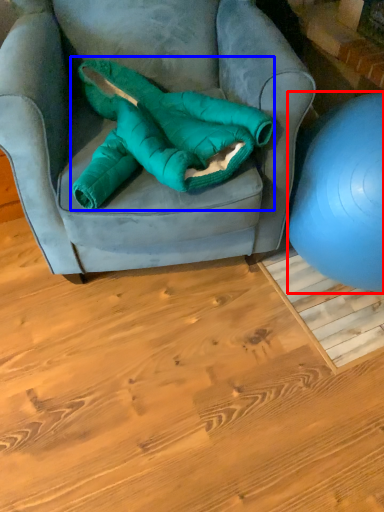
Question: Which point is closer to the camera, ball (highlighted by a red box) or bean bag chair (highlighted by a blue box)?

Choices:
 (A) ball
 (B) bean bag chair

Answer: (A)